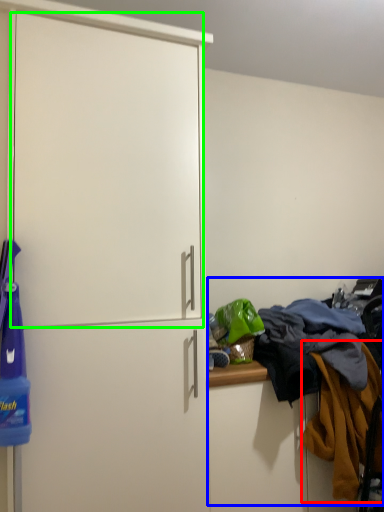
Question: Which is nearer to the clothing (highlighted by a red box)? laundry (highlighted by a blue box) or screen door (highlighted by a green box).

Choices:
 (A) laundry
 (B) screen door

Answer: (A)